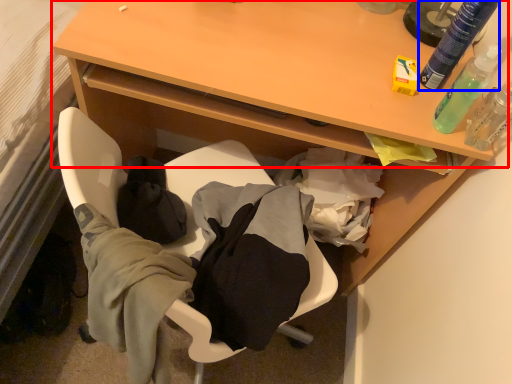
Question: Which object is further to the camera taking this photo, table (highlighted by a red box) or bottle (highlighted by a blue box)?

Choices:
 (A) table
 (B) bottle

Answer: (A)